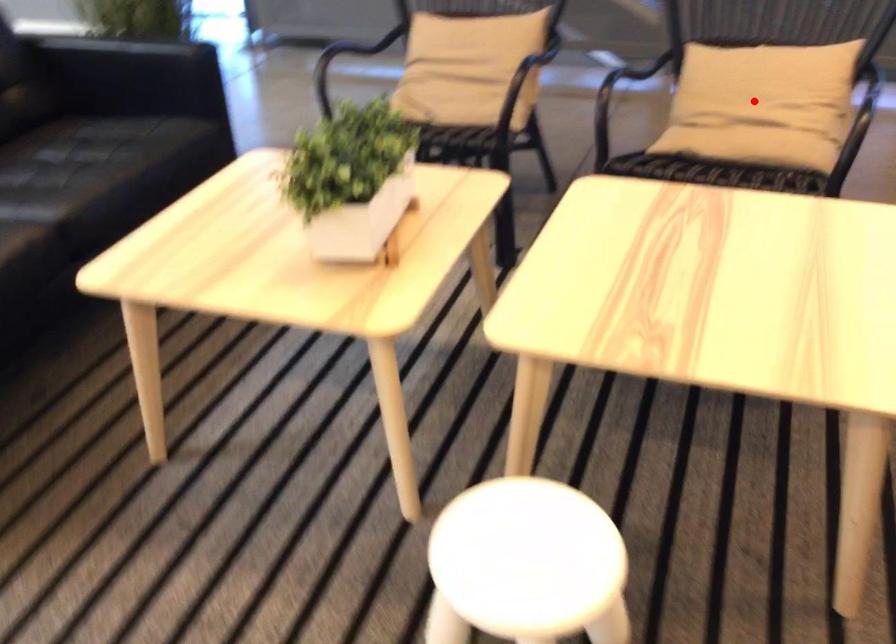
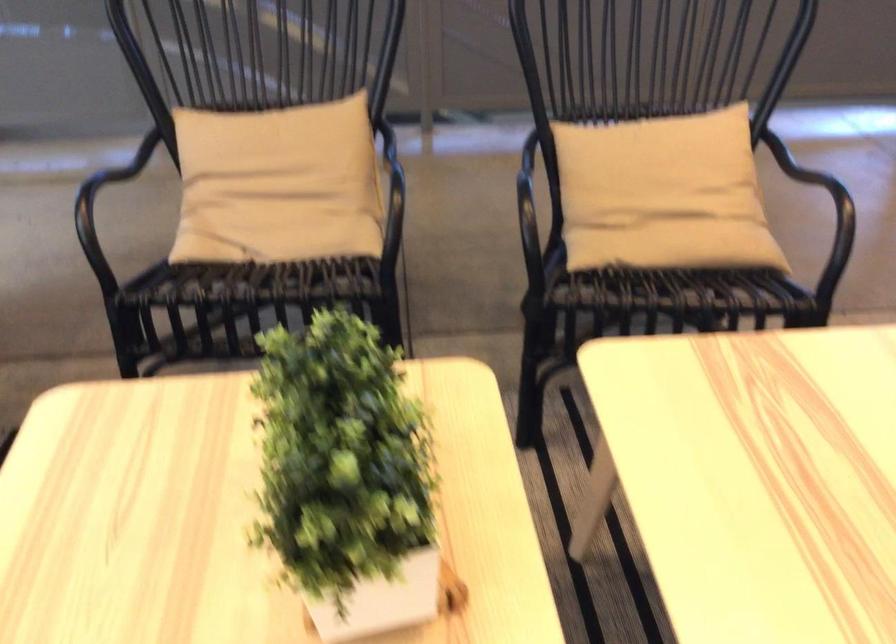
Find the pixel in the second image that matches the highlighted location in the first image.

(662, 194)